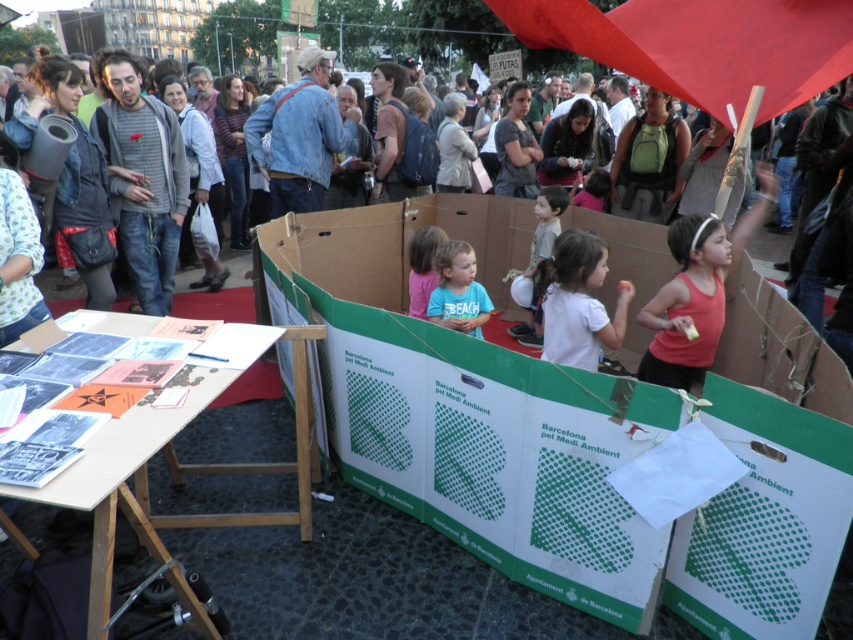
Which is more to the left, green cardboard box at center or blue cotton shirt at center?

green cardboard box at center is more to the left.

Can you confirm if green cardboard box at center is positioned below blue cotton shirt at center?

Yes.

Is point (546, 422) in front of point (457, 330)?

Yes, point (546, 422) is in front of point (457, 330).

You are a GUI agent. You are given a task and a screenshot of the screen. Output one action in this format:
    pyautogui.click(x=<x>, y=<y>)
    Task: Click on the green cardboard box at center
    This screenshot has width=853, height=640.
    Given the screenshot: What is the action you would take?
    pyautogui.click(x=569, y=429)

Is green cardboard box at center above wooden table at lower left?

Correct, green cardboard box at center is located above wooden table at lower left.

Is green cardboard box at center to the left of wooden table at lower left from the viewer's perspective?

Incorrect, green cardboard box at center is not on the left side of wooden table at lower left.

Find the location of a particular element. Image resolution: width=853 pixels, height=640 pixels. green cardboard box at center is located at coordinates click(x=569, y=429).

You are a GUI agent. You are given a task and a screenshot of the screen. Output one action in this format:
    pyautogui.click(x=<x>, y=<y>)
    Task: Click on the green cardboard box at center
    Image resolution: width=853 pixels, height=640 pixels.
    Given the screenshot: What is the action you would take?
    pyautogui.click(x=569, y=429)

Which is more to the right, wooden table at lower left or white matte shirt at center?

From the viewer's perspective, white matte shirt at center appears more on the right side.

This screenshot has height=640, width=853. What do you see at coordinates (172, 467) in the screenshot?
I see `wooden table at lower left` at bounding box center [172, 467].

Does point (149, 417) come closer to viewer compared to point (602, 248)?

Yes, point (149, 417) is closer to viewer.

This screenshot has height=640, width=853. I want to click on wooden table at lower left, so click(x=172, y=467).